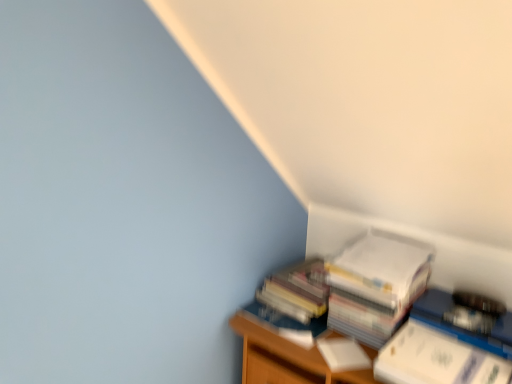
You are a GUI agent. You are given a task and a screenshot of the screen. Output one action in this format:
    pyautogui.click(x=<x>, y=<y>)
    Task: Click on the free point to the left of white matte paperback book at lower right, placed as the second paperback book when sorted from front to back
    Image resolution: width=512 pixels, height=384 pixels.
    Given the screenshot: What is the action you would take?
    pyautogui.click(x=291, y=344)